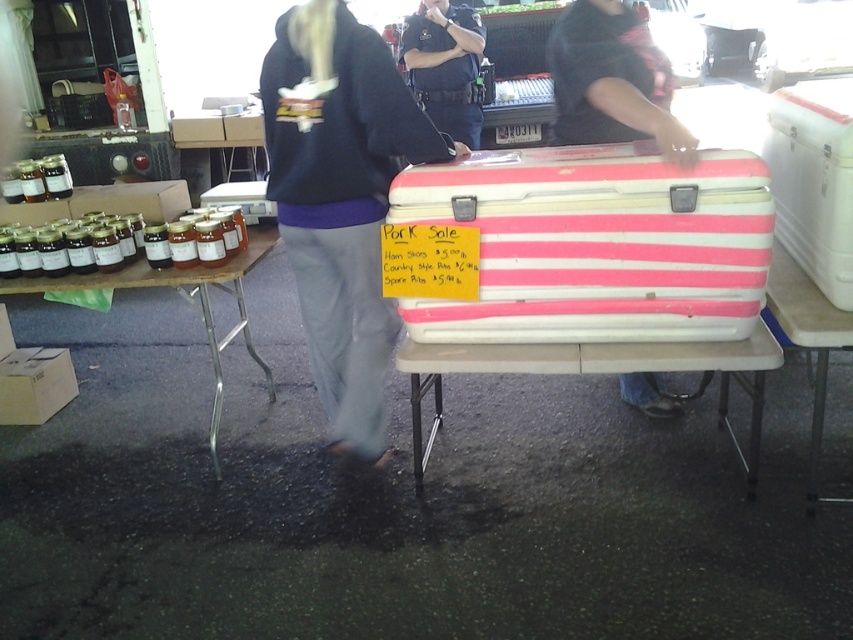
Which is more to the right, wooden table at lower left or white plastic table at lower right?

white plastic table at lower right

Is wooden table at lower left to the left of white plastic table at lower right from the viewer's perspective?

Yes, wooden table at lower left is to the left of white plastic table at lower right.

Is point (93, 284) positioned behind point (772, 273)?

Yes, it is.

At what (x,y) coordinates should I click in order to perform the action: click on wooden table at lower left. Please return your answer as a coordinate pair (x, y). The width and height of the screenshot is (853, 640). Looking at the image, I should click on (186, 301).

Can you confirm if matte plastic suitcase at center is smaller than wooden table at lower left?

Yes, matte plastic suitcase at center is smaller than wooden table at lower left.

Does point (556, 131) lie in front of point (216, 353)?

That is True.

Measure the distance between point [569,65] and camera.

The distance of point [569,65] from camera is 7.05 feet.

This screenshot has width=853, height=640. Identify the location of matte plastic suitcase at center. (612, 81).

Between wooden table at lower left and dark blue uniform at center, which one is positioned higher?

dark blue uniform at center is above.

The height and width of the screenshot is (640, 853). What do you see at coordinates (186, 301) in the screenshot? I see `wooden table at lower left` at bounding box center [186, 301].

Locate an element on the screen. The width and height of the screenshot is (853, 640). wooden table at lower left is located at coordinates [186, 301].